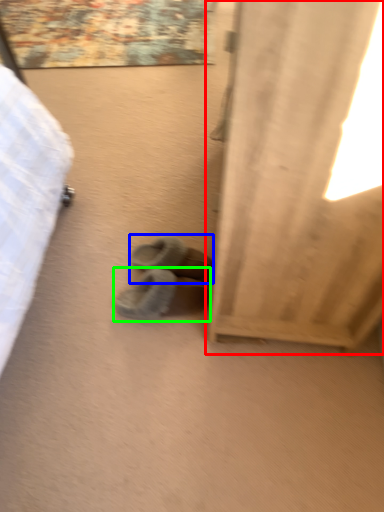
Question: Estimate the real-world distances between objects in this image. Which object is farther from curtain (highlighted by a red box), footwear (highlighted by a blue box) or footwear (highlighted by a green box)?

Choices:
 (A) footwear
 (B) footwear

Answer: (A)